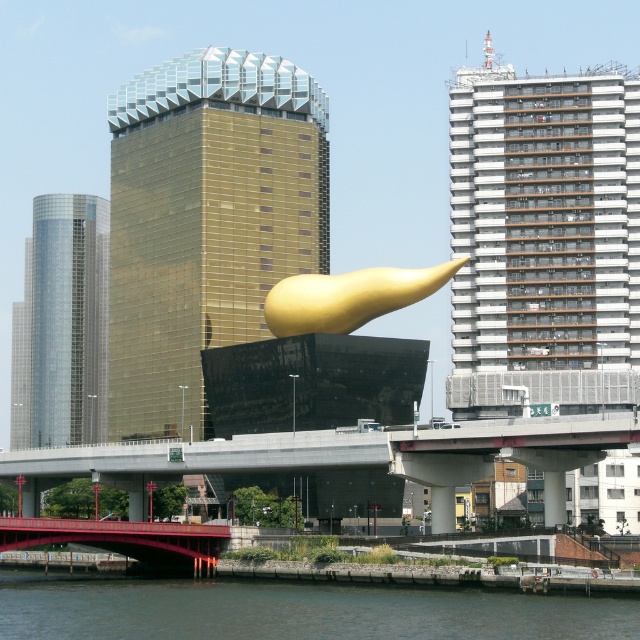
Question: Which point is farther from the camera taking this photo?

Choices:
 (A) [260, 129]
 (B) [38, 518]
 (C) [420, 268]

Answer: (C)

Question: Can you confirm if gold reflective glass building at center is positioned below gold polished sculpture at center?

Choices:
 (A) no
 (B) yes

Answer: (A)

Question: Which object is positioned farthest from the white textured building at upper right?

Choices:
 (A) dark gray water at lower left
 (B) metallic red bridge at lower center
 (C) gold polished sculpture at center

Answer: (A)

Question: Is white textured building at upper right positioned behind gold polished sculpture at center?

Choices:
 (A) yes
 (B) no

Answer: (B)

Question: Which of these objects is positioned farthest from the dark gray water at lower left?

Choices:
 (A) white textured building at upper right
 (B) gold reflective glass building at center

Answer: (B)

Question: Considering the relative positions of dark gray water at lower left and shiny glass skyscraper at left in the image provided, where is dark gray water at lower left located with respect to shiny glass skyscraper at left?

Choices:
 (A) below
 (B) above

Answer: (A)